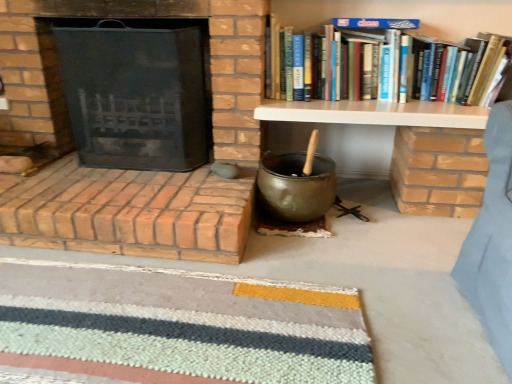
Question: Is brick fireplace at left, the 1th fireplace in the bottom-to-top sequence, spatially inside striped wool doormat at lower center, or outside of it?

Choices:
 (A) inside
 (B) outside

Answer: (B)

Question: Looking at the image, does brick fireplace at left, the 1th fireplace in the bottom-to-top sequence, seem bigger or smaller compared to striped wool doormat at lower center?

Choices:
 (A) small
 (B) big

Answer: (B)

Question: Considering the real-world distances, which object is farthest from the hardcover books at upper right?

Choices:
 (A) striped wool doormat at lower center
 (B) black mesh fireplace screen at left, the 1th fireplace in the top-to-bottom sequence
 (C) white wood shelf at upper right
 (D) brick fireplace at left, the 1th fireplace in the bottom-to-top sequence

Answer: (A)

Question: Which is nearer to the striped wool doormat at lower center?

Choices:
 (A) white wood shelf at upper right
 (B) black mesh fireplace screen at left, the second fireplace ordered from the bottom
 (C) brick fireplace at left, the 1th fireplace in the bottom-to-top sequence
 (D) hardcover books at upper right

Answer: (C)